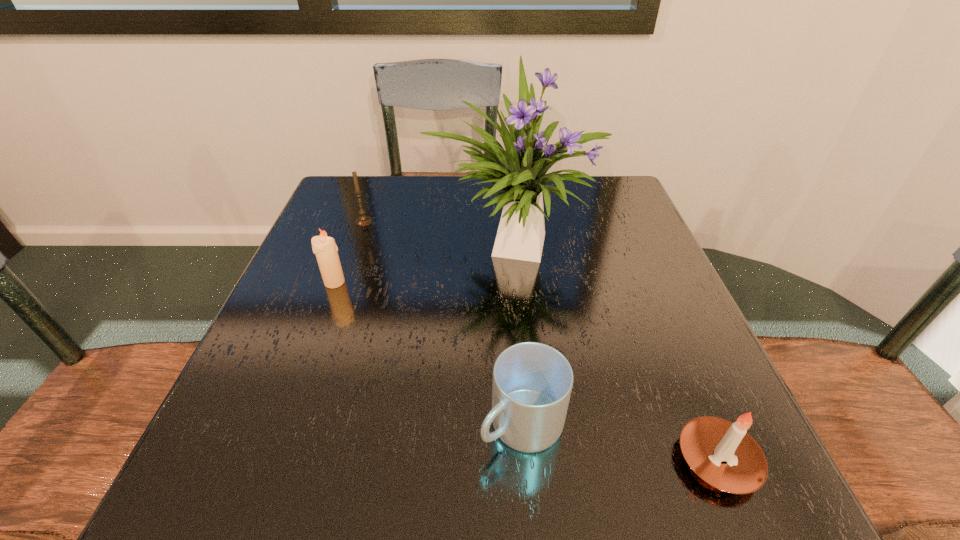
This screenshot has width=960, height=540. I want to click on blank region between the rightmost object and the mug, so click(619, 442).

The width and height of the screenshot is (960, 540). What are the coordinates of `empty space that is in between the nearest candle and the farthest candle` in the screenshot? It's located at (x=540, y=341).

This screenshot has height=540, width=960. What are the coordinates of `blank region between the farthest candle and the nearest candle` in the screenshot? It's located at (540, 341).

Find the location of a particular element. unoccupied position between the rightmost candle and the mug is located at coordinates (619, 442).

Select which object is the second closest to the mug. Please provide its 2D coordinates. Your answer should be formatted as a tuple, i.e. [(x, y)], where the tuple contains the x and y coordinates of a point satisfying the conditions above.

[(520, 172)]

Identify which object is the third closest to the rightmost object. Please provide its 2D coordinates. Your answer should be formatted as a tuple, i.e. [(x, y)], where the tuple contains the x and y coordinates of a point satisfying the conditions above.

[(324, 247)]

What are the coordinates of `candle that is the second closest to the second farthest candle` in the screenshot? It's located at (722, 453).

Locate which candle ranks second in proximity to the farthest candle. Please provide its 2D coordinates. Your answer should be formatted as a tuple, i.e. [(x, y)], where the tuple contains the x and y coordinates of a point satisfying the conditions above.

[(722, 453)]